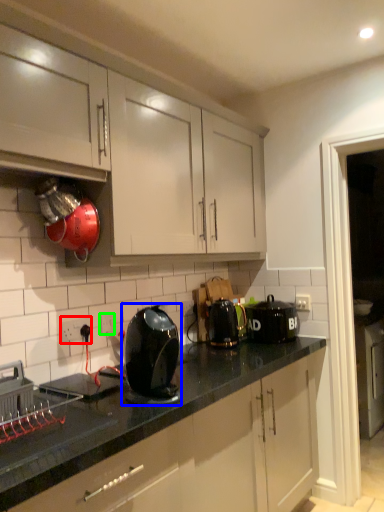
Question: Which object is positioned closest to electric outlet (highlighted by a red box)? Select from kitchen appliance (highlighted by a blue box) and electric outlet (highlighted by a green box).

Choices:
 (A) kitchen appliance
 (B) electric outlet

Answer: (B)